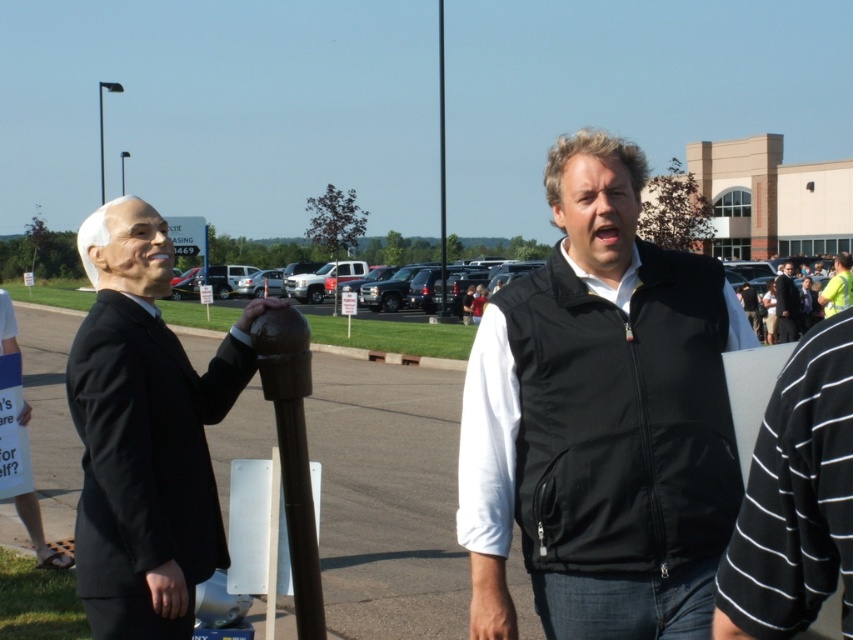
Is dark gray asphalt parking lot at center in front of brown wooden pole at center?

Yes.

Can you confirm if dark gray asphalt parking lot at center is positioned below brown wooden pole at center?

Yes.

Is point (215, 307) farther from viewer compared to point (444, 132)?

Yes, point (215, 307) is behind point (444, 132).

Image resolution: width=853 pixels, height=640 pixels. I want to click on dark gray asphalt parking lot at center, so click(x=393, y=333).

Looking at this image, which is more to the right, dark gray asphalt parking lot at center or black suit at center?

black suit at center

From the picture: Who is shorter, dark gray asphalt parking lot at center or black suit at center?

dark gray asphalt parking lot at center is shorter.

Between point (189, 304) and point (786, 273), which one is positioned behind?

The point (189, 304) is behind.

You are a GUI agent. You are given a task and a screenshot of the screen. Output one action in this format:
    pyautogui.click(x=<x>, y=<y>)
    Task: Click on the dark gray asphalt parking lot at center
    
    Given the screenshot: What is the action you would take?
    pyautogui.click(x=393, y=333)

Does point (628, 568) come behind point (119, 371)?

No, (628, 568) is closer to viewer.

Find the location of a particular element. Image resolution: width=853 pixels, height=640 pixels. black softshell vest at center is located at coordinates (601, 420).